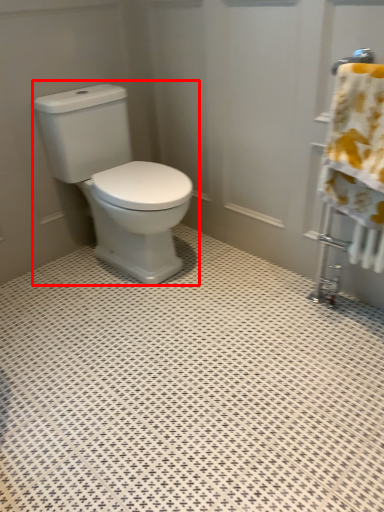
Question: From the image's perspective, what is the correct spatial relationship of toilet (annotated by the red box) in relation to bath towel?

Choices:
 (A) below
 (B) above

Answer: (B)